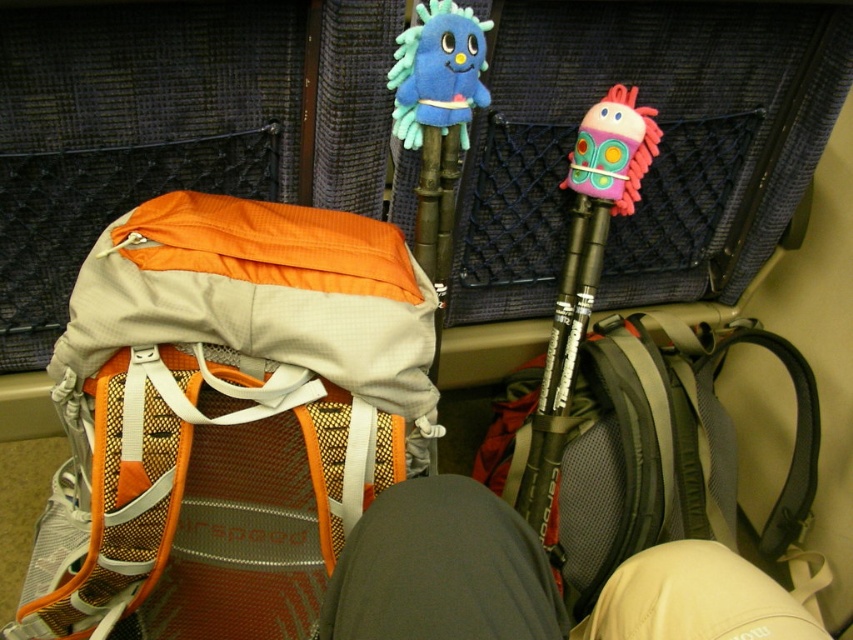
Can you confirm if gray mesh backpack at lower right is positioned to the right of pink fuzzy toy at center?

Yes, gray mesh backpack at lower right is to the right of pink fuzzy toy at center.

Is point (802, 384) closer to camera compared to point (607, 189)?

No, it is not.

You are a GUI agent. You are given a task and a screenshot of the screen. Output one action in this format:
    pyautogui.click(x=<x>, y=<y>)
    Task: Click on the gray mesh backpack at lower right
    
    Given the screenshot: What is the action you would take?
    pyautogui.click(x=664, y=451)

Does orange mesh backpack at center appear on the right side of pink fuzzy toy at center?

Incorrect, orange mesh backpack at center is not on the right side of pink fuzzy toy at center.

Is orange mesh backpack at center taller than pink fuzzy toy at center?

No.

What do you see at coordinates (225, 417) in the screenshot?
I see `orange mesh backpack at center` at bounding box center [225, 417].

At what (x,y) coordinates should I click in order to perform the action: click on orange mesh backpack at center. Please return your answer as a coordinate pair (x, y). The image size is (853, 640). Looking at the image, I should click on (225, 417).

Which of these two, gray fabric pants at lower center or fluffy pink and purple toy at center, stands shorter?

fluffy pink and purple toy at center is shorter.

Is point (802, 609) positioned after point (630, 179)?

No, it is in front of (630, 179).

Does point (352, 554) come in front of point (643, 108)?

Yes, it is in front of point (643, 108).

At what (x,y) coordinates should I click in order to perform the action: click on gray fabric pants at lower center. Please return your answer as a coordinate pair (x, y). Looking at the image, I should click on (531, 580).